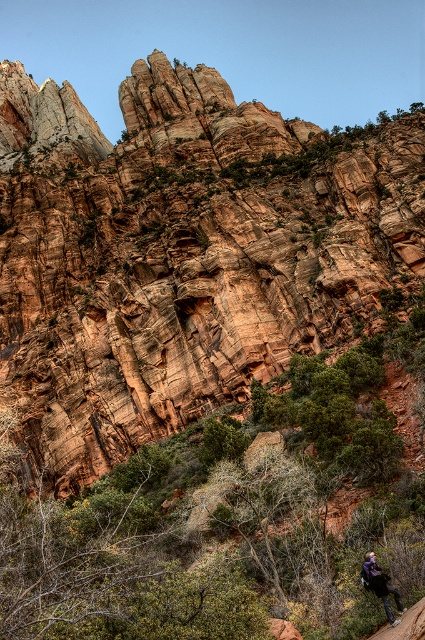
You are standing in the rugged landscape and want to move from the point closer to you to the point farther away. Which path should you take between the two points, point (65, 492) and point (382, 598)?

You should take the path leading from point (65, 492) to point (382, 598) because point (65, 492) is closer to you, and point (382, 598) is farther away.

Based on the photo, you are hiking and need to place your purple fabric backpack at lower right near the rustic rock formation at center. Based on the scene, which direction should you move relative to your current position to place it correctly?

The rustic rock formation at center is to the left of the purple fabric backpack at lower right. To place the backpack correctly, you should move it to the left so it aligns with the rock formation.